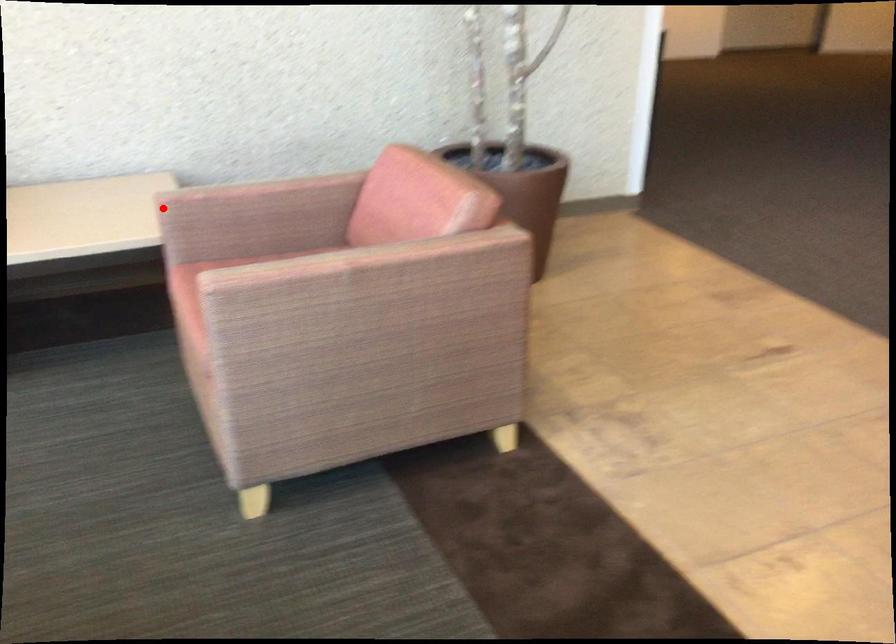
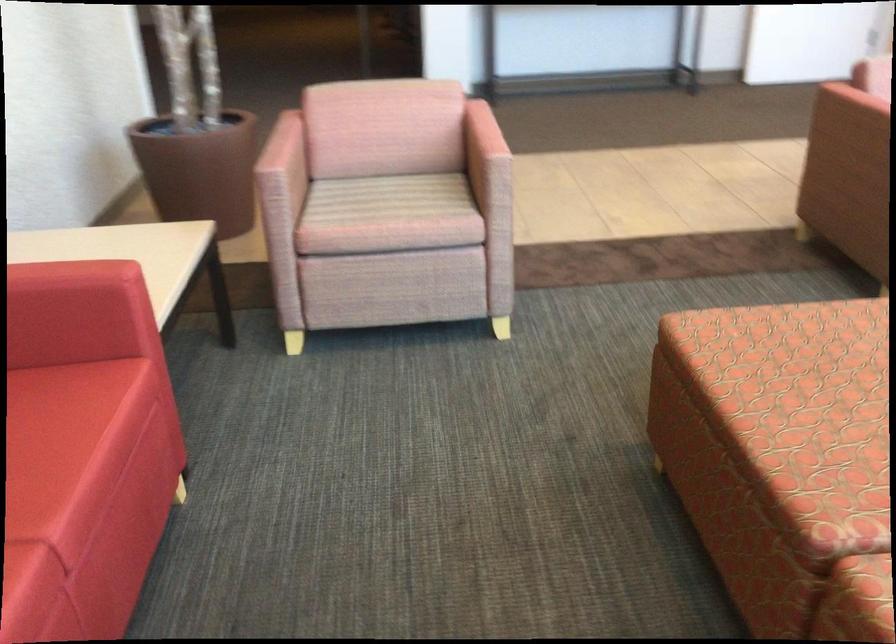
Where in the second image is the point corresponding to the highlighted location from the first image?

(280, 176)